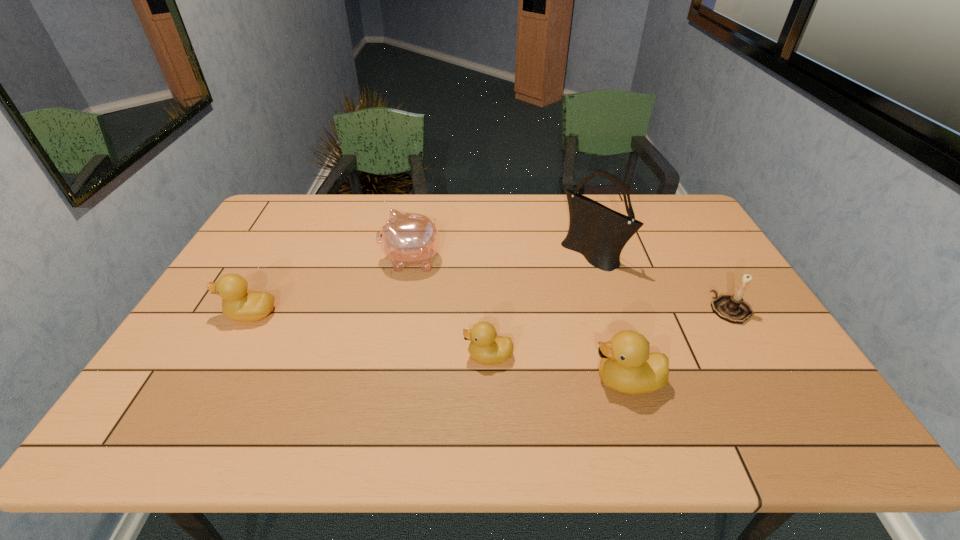
The image size is (960, 540). I want to click on free space between the rightmost object and the rightmost duckling, so (x=679, y=345).

The image size is (960, 540). Identify the location of blank region between the leftmost object and the shortest duckling. (370, 335).

This screenshot has width=960, height=540. I want to click on free spot between the tallest object and the leftmost object, so click(421, 284).

The height and width of the screenshot is (540, 960). Identify the location of free spot between the candle holder and the second duckling from left to right. (610, 333).

In order to click on vacant area that lies between the rightmost duckling and the farthest duckling in this screenshot , I will do `click(439, 347)`.

Where is `vacant space that is in between the leftmost object and the rightmost object`? Image resolution: width=960 pixels, height=540 pixels. vacant space that is in between the leftmost object and the rightmost object is located at coordinates (491, 312).

The height and width of the screenshot is (540, 960). What are the coordinates of `vacant area that lies between the leftmost duckling and the candle holder` in the screenshot? It's located at (491, 312).

This screenshot has width=960, height=540. What are the coordinates of `free area in between the piggy bank and the rightmost duckling` in the screenshot? It's located at (519, 321).

At what (x,y) coordinates should I click in order to perform the action: click on object that is the third closest one to the fifth object from right to left. Please return your answer as a coordinate pair (x, y). Looking at the image, I should click on (599, 233).

Where is `object that can be found as the third closest to the piggy bank`? Image resolution: width=960 pixels, height=540 pixels. object that can be found as the third closest to the piggy bank is located at coordinates (599, 233).